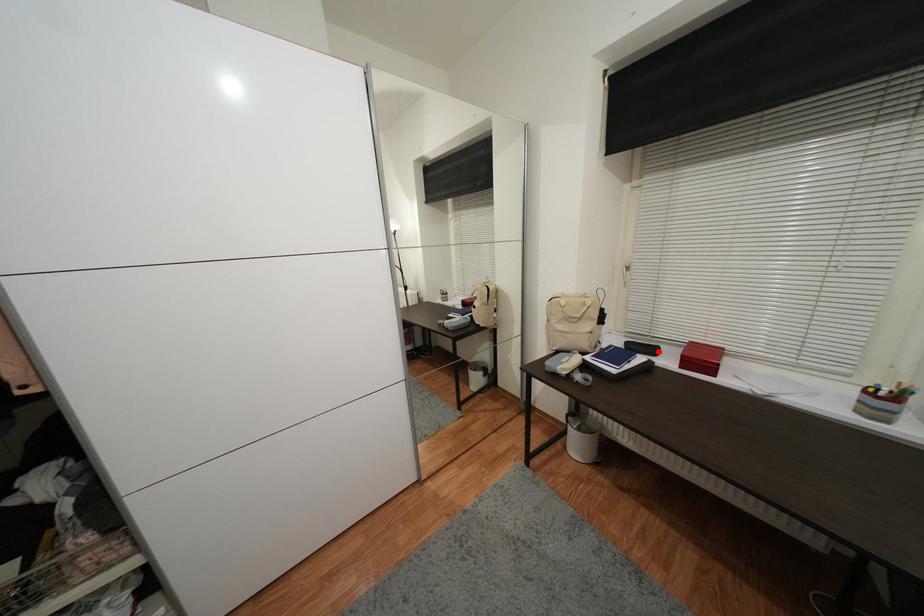
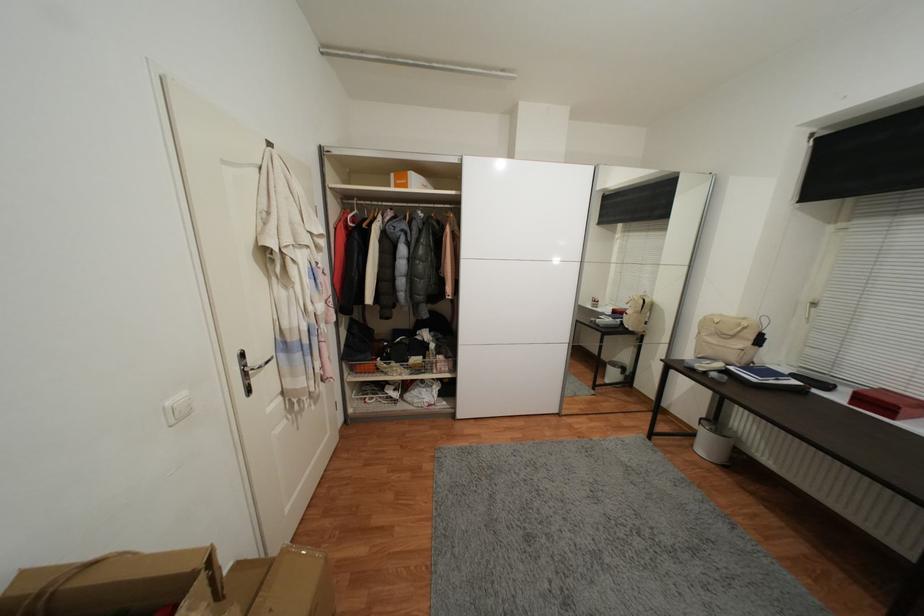
In the second image, find the point that corresponds to the highlighted location in the first image.

(831, 387)